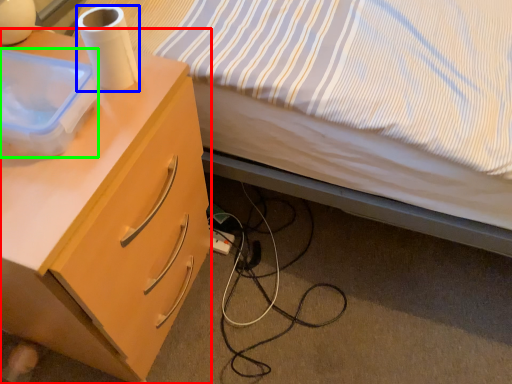
Question: Based on their relative distances, which object is nearer to desk (highlighted by a red box)? Choose from paper towel (highlighted by a blue box) and box (highlighted by a green box).

Choices:
 (A) paper towel
 (B) box

Answer: (B)